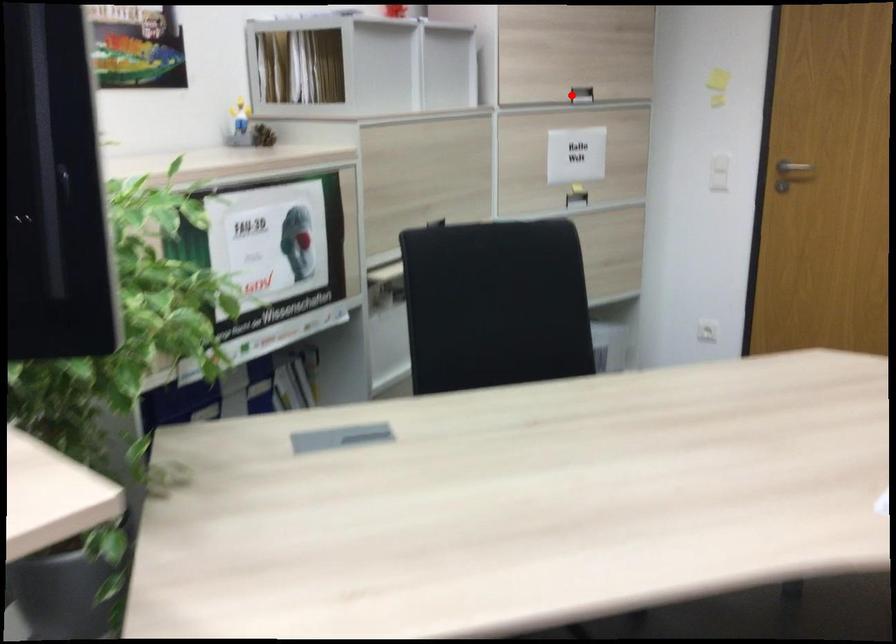
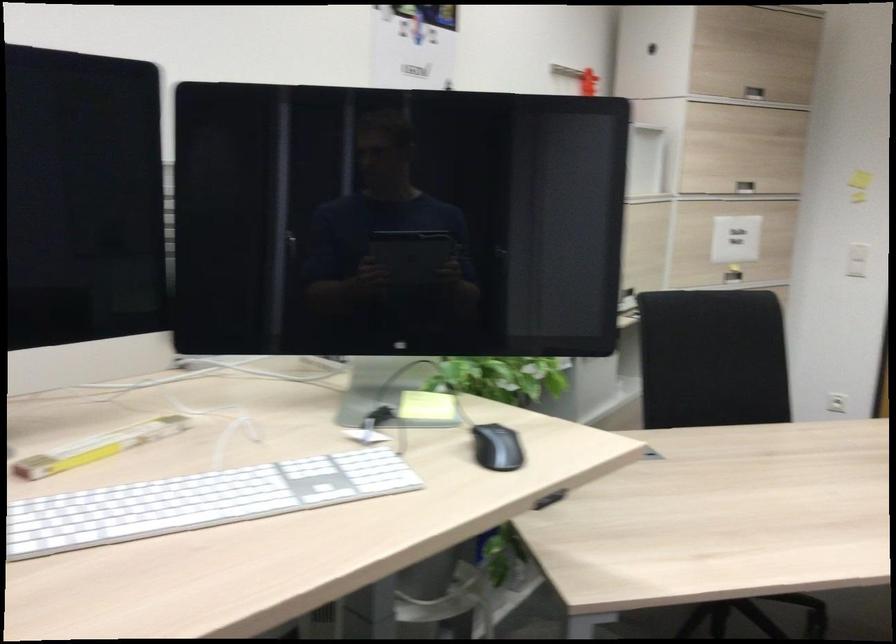
Where in the second image is the point corresponding to the highlighted location from the first image?

(745, 187)